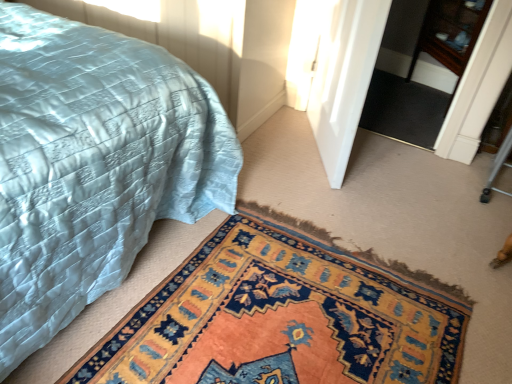
The image size is (512, 384). What are the coordinates of `vacant space situated on the left part of white glossy door at center` in the screenshot? It's located at (272, 149).